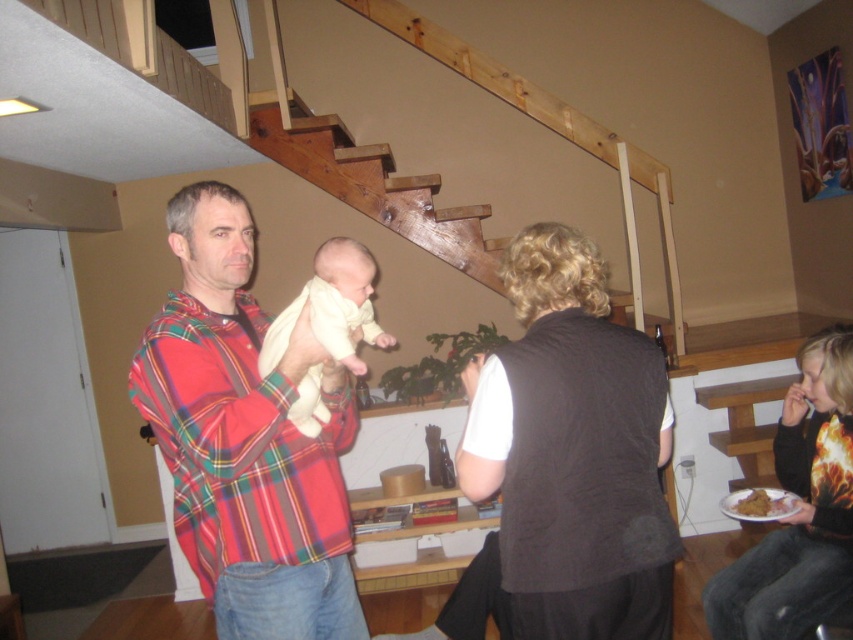
Who is taller, dark gray vest at center or golden crispy chicken at lower right?

dark gray vest at center is taller.

Image resolution: width=853 pixels, height=640 pixels. Find the location of `dark gray vest at center`. dark gray vest at center is located at coordinates (572, 451).

Between point (341, 486) and point (293, 408), which one is positioned in front?

Point (293, 408) is more forward.

Is plaid shirt at center positioned before white clothed baby at center?

Yes, it is in front of white clothed baby at center.

Does point (346, 522) lie behind point (318, 408)?

Yes.

Locate an element on the screen. The width and height of the screenshot is (853, 640). plaid shirt at center is located at coordinates (247, 438).

Does plaid shirt at center appear over golden crispy chicken at lower right?

Yes.

Is plaid shirt at center positioned behind golden crispy chicken at lower right?

No.

What do you see at coordinates (247, 438) in the screenshot? I see `plaid shirt at center` at bounding box center [247, 438].

Where is `plaid shirt at center`? The width and height of the screenshot is (853, 640). plaid shirt at center is located at coordinates (247, 438).